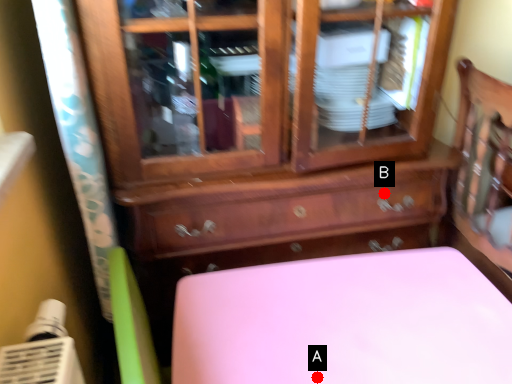
Question: Two points are circled on the image, labeled by A and B beside each circle. Which of the following is the farthest from the observer?

Choices:
 (A) A is further
 (B) B is further

Answer: (B)